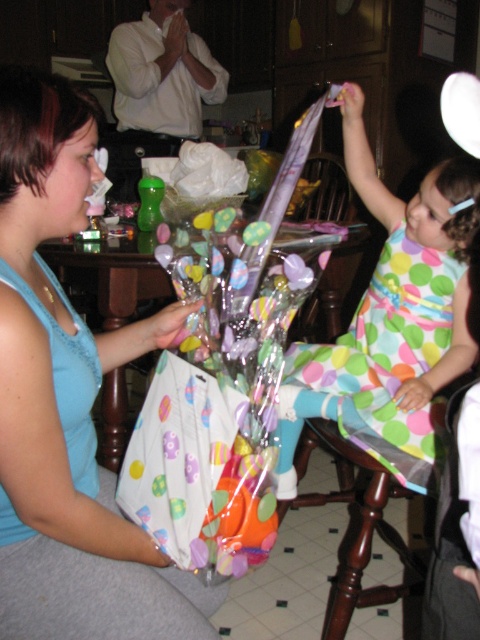
You are standing in the kitchen and see a point at coordinates (78, 184). If you want to place a 12 inch cake on that point, will it fit entirely within the visible area?

The point at coordinates (78, 184) is 35.92 inches away from the viewer. Since the cake is only 12 inches in diameter, there is sufficient space for it to fit entirely within the visible area as the distance is more than enough to accommodate the cake.

You are organizing a gift wrapping station in the kitchen. You have a polka dot dress at center and a brown wood stool at lower center. Which object should you move to make space for the gift wrapping supplies?

You should move the brown wood stool at lower center because the polka dot dress at center is to the left of it, meaning the stool is on the right side and might be blocking access to the workspace.

You are organizing a gift wrapping station in the kitchen. You have a matte blue tank top at left and a brown wood stool at lower center. Which item takes up more space?

The brown wood stool at lower center takes up more space because it is larger than the matte blue tank top at left.